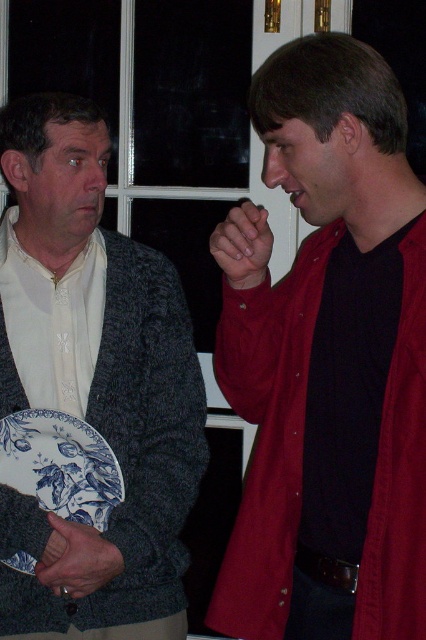
Question: Which point is closer to the camera?

Choices:
 (A) blue printed platter at left
 (B) matte red shirt at center
 (C) matte black sweater at left

Answer: (B)

Question: Which point is closer to the camera?

Choices:
 (A) (115, 529)
 (B) (81, 465)

Answer: (A)

Question: Among these points, which one is nearest to the camera?

Choices:
 (A) (40, 604)
 (B) (49, 445)
 (C) (356, 221)

Answer: (C)

Question: Can you confirm if matte red shirt at center is positioned to the left of blue printed platter at left?

Choices:
 (A) no
 (B) yes

Answer: (A)

Question: Can you confirm if matte red shirt at center is thinner than blue printed platter at left?

Choices:
 (A) no
 (B) yes

Answer: (A)

Question: Can you confirm if matte red shirt at center is thinner than blue printed platter at left?

Choices:
 (A) yes
 (B) no

Answer: (B)